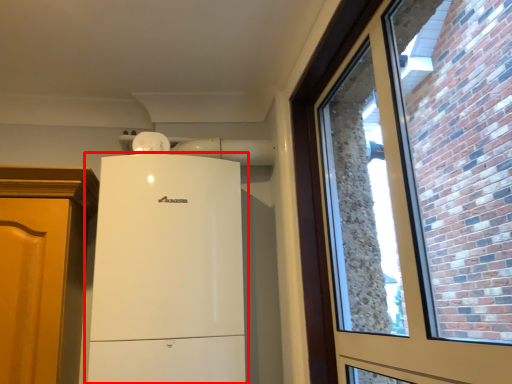
Question: From the image's perspective, where is refrigerator (annotated by the red box) located relative to window?

Choices:
 (A) above
 (B) below

Answer: (B)